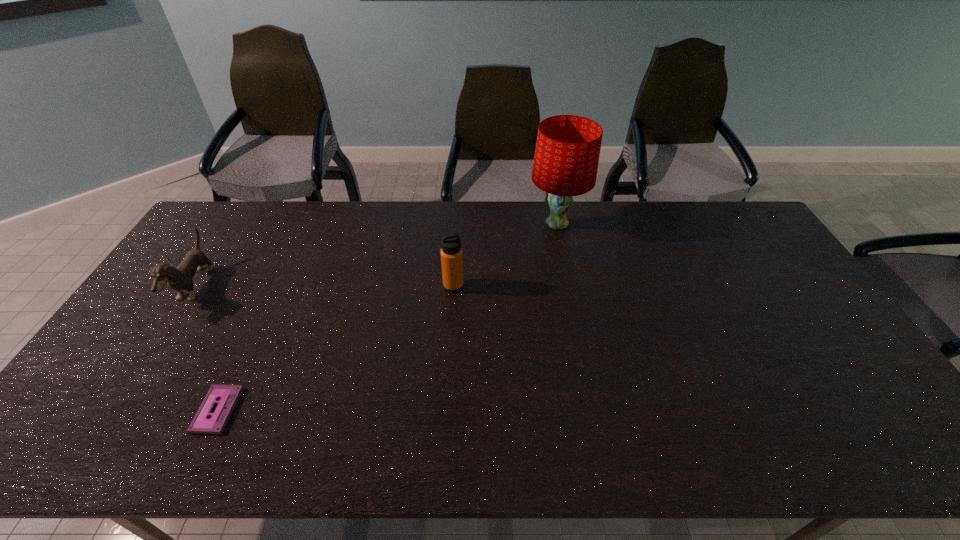
I want to click on blank area at the right edge, so click(x=734, y=253).

The image size is (960, 540). I want to click on free spot between the third object from left to right and the shortest object, so click(x=335, y=348).

The image size is (960, 540). I want to click on empty space between the second shortest object and the rightmost object, so click(375, 255).

Locate an element on the screen. blank region between the second object from right to left and the rightmost object is located at coordinates (505, 255).

Where is `blank region between the third object from left to right and the second object from left to right`? Image resolution: width=960 pixels, height=540 pixels. blank region between the third object from left to right and the second object from left to right is located at coordinates (335, 348).

Locate an element on the screen. Image resolution: width=960 pixels, height=540 pixels. empty location between the shortest object and the lampshade is located at coordinates coord(387,317).

This screenshot has width=960, height=540. In order to click on free space between the farthest object and the second object from left to right in this screenshot , I will do `click(387, 317)`.

Locate an element on the screen. The width and height of the screenshot is (960, 540). free area in between the nearest object and the farthest object is located at coordinates (387, 317).

Locate an element on the screen. The height and width of the screenshot is (540, 960). free area in between the farthest object and the shortest object is located at coordinates pyautogui.click(x=387, y=317).

This screenshot has width=960, height=540. Find the location of `vacant space in between the rightmost object and the second tallest object`. vacant space in between the rightmost object and the second tallest object is located at coordinates (505, 255).